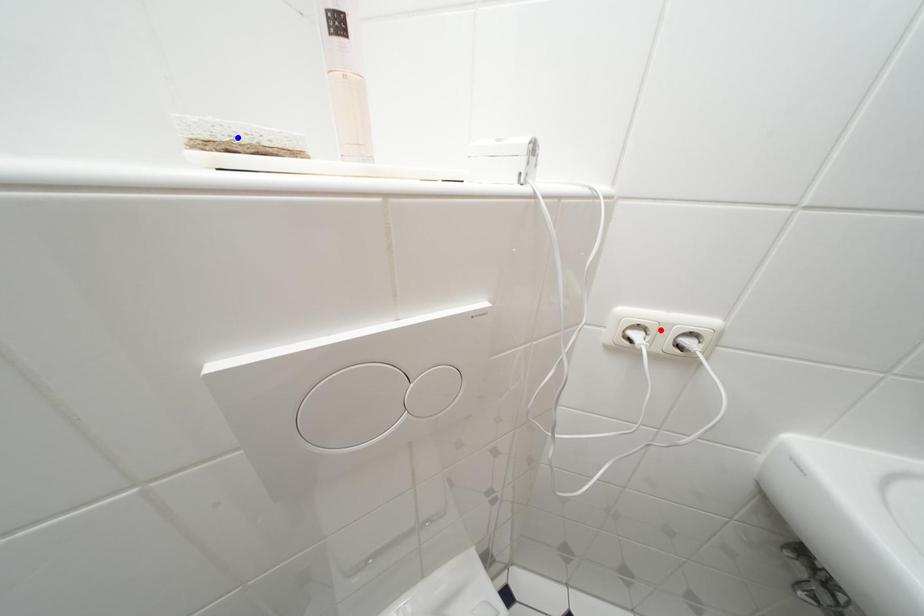
Question: Two points are marked on the image. Which point is closer to the camera?

Choices:
 (A) Blue point is closer.
 (B) Red point is closer.

Answer: (A)